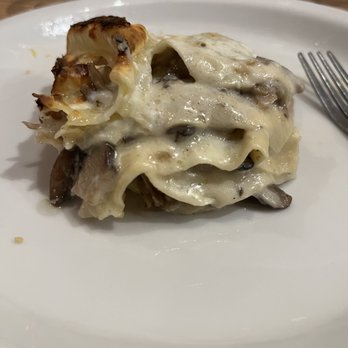
Where is `food splatter on plate`? The height and width of the screenshot is (348, 348). food splatter on plate is located at coordinates (17, 241), (35, 54).